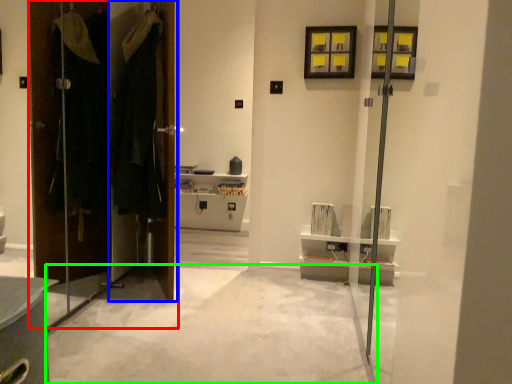
Question: Which is farther away from door (highlighted by a red box)? door (highlighted by a blue box) or concrete (highlighted by a green box)?

Choices:
 (A) door
 (B) concrete

Answer: (B)